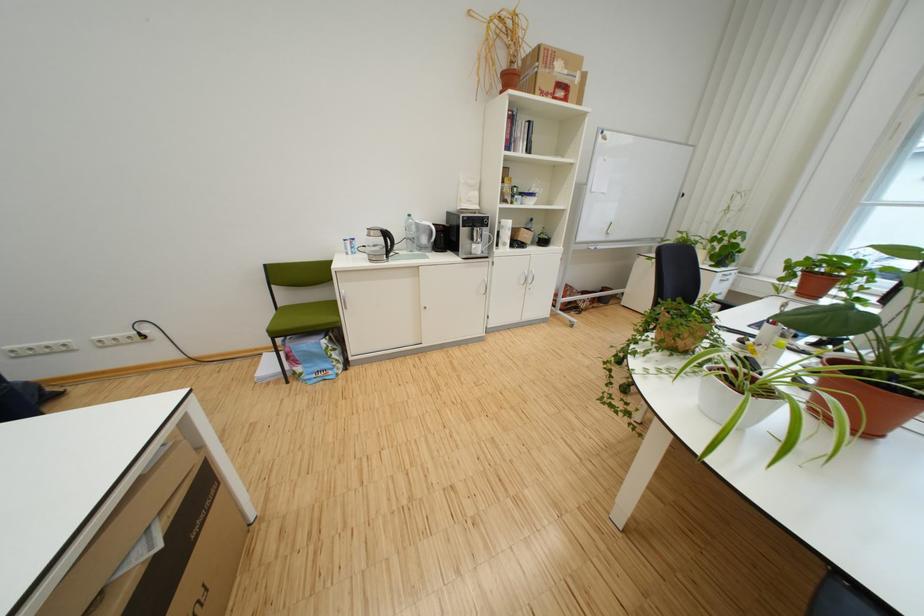
Find where to grasp the black whiteboard marker. Please return your answer as a coordinate pair (x, y).

(613, 227)